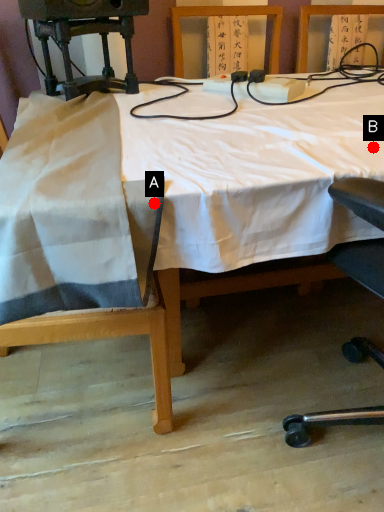
Question: Two points are circled on the image, labeled by A and B beside each circle. Which point is closer to the camera?

Choices:
 (A) A is closer
 (B) B is closer

Answer: (A)